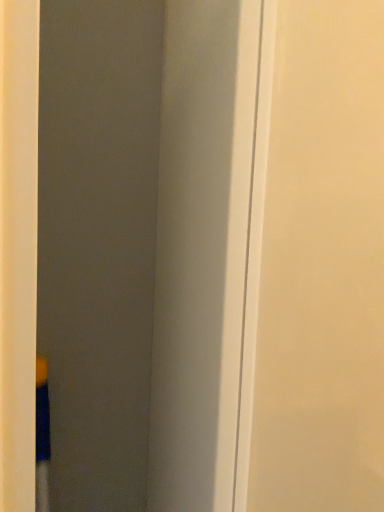
Image resolution: width=384 pixels, height=512 pixels. I want to click on white matte door at center, so click(x=321, y=262).

This screenshot has height=512, width=384. Describe the element at coordinates (321, 262) in the screenshot. I see `white matte door at center` at that location.

In order to face white matte door at center, should I rotate leftwards or rightwards?

You should look right and rotate roughly 20.989 degrees.

This screenshot has width=384, height=512. I want to click on white matte door at center, so click(321, 262).